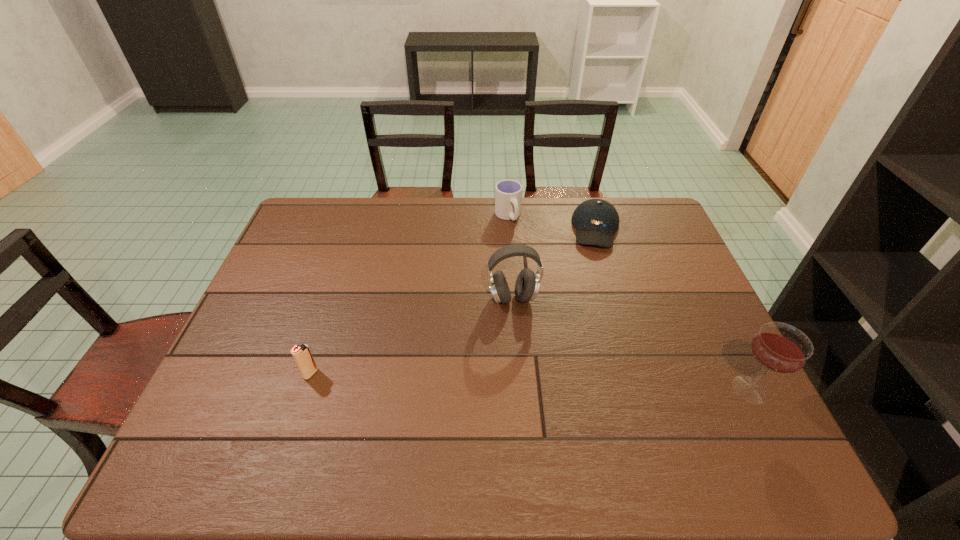
You are a GUI agent. You are given a task and a screenshot of the screen. Output one action in this format:
    pyautogui.click(x=<x>, y=<y>)
    Task: Click on the unoccupied area between the headset and the cup
    The height and width of the screenshot is (540, 960).
    Given the screenshot: What is the action you would take?
    pyautogui.click(x=511, y=257)

At what (x,y) coordinates should I click in order to perform the action: click on empty location between the cup and the baseball cap. Please return your answer as a coordinate pair (x, y). The height and width of the screenshot is (540, 960). Looking at the image, I should click on (552, 223).

Locate an element on the screen. empty space that is in between the second object from right to left and the third nearest object is located at coordinates (555, 264).

This screenshot has height=540, width=960. Identify the location of blank region between the baseball cap and the headset. (555, 264).

The height and width of the screenshot is (540, 960). I want to click on vacant point located between the third farthest object and the baseball cap, so click(555, 264).

Image resolution: width=960 pixels, height=540 pixels. What are the coordinates of `free space between the third farthest object and the leftmost object` in the screenshot? It's located at (412, 336).

Identify the location of the fourth closest object to the shortest object. (301, 354).

Find the location of a particular element. This screenshot has height=540, width=960. object that is the second nearest to the wineglass is located at coordinates (527, 285).

You are a GUI agent. You are given a task and a screenshot of the screen. Output one action in this format:
    pyautogui.click(x=<x>, y=<y>)
    Task: Click on the free location that satisfies the following two spatial constraints: 1. on the front side of the igniter; 2. on the right side of the wineglass
    
    Given the screenshot: What is the action you would take?
    pyautogui.click(x=305, y=389)

Locate an element on the screen. vacant space that satisfies the following two spatial constraints: 1. on the front side of the rightmost object; 2. on the right side of the cup is located at coordinates (521, 389).